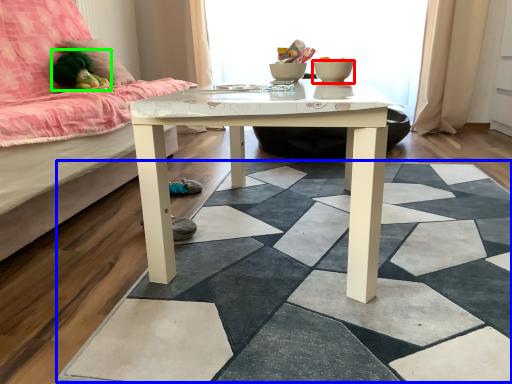
Question: Which object is the farthest from glass bowl (highlighted by a red box)? Choose among these: square (highlighted by a blue box) or toy (highlighted by a green box).

Choices:
 (A) square
 (B) toy

Answer: (B)